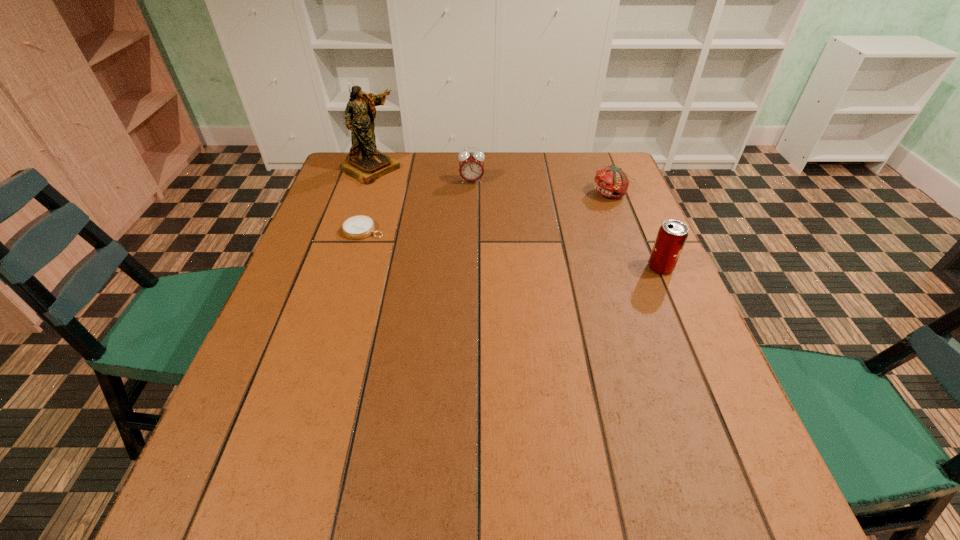
Find the location of `compass present at the left edge`. compass present at the left edge is located at coordinates (358, 227).

Identify the location of figurine located at the left edge. (x=366, y=164).

At what (x,y) coordinates should I click in order to perform the action: click on beer can that is at the right edge. Please return your answer as a coordinate pair (x, y). Looking at the image, I should click on (672, 235).

The image size is (960, 540). In order to click on tomato that is at the right edge in this screenshot , I will do `click(612, 182)`.

Identify the location of object that is at the far left corner. This screenshot has height=540, width=960. (366, 164).

Locate an element on the screen. The height and width of the screenshot is (540, 960). object located in the far right corner section of the desktop is located at coordinates (612, 182).

I want to click on free spot at the far edge of the desktop, so (x=551, y=165).

In order to click on free space at the near edge in this screenshot , I will do `click(399, 418)`.

Identify the location of blank space at the left edge. (326, 287).

The height and width of the screenshot is (540, 960). Find the location of `vacant region at the right edge of the desktop`. vacant region at the right edge of the desktop is located at coordinates (636, 357).